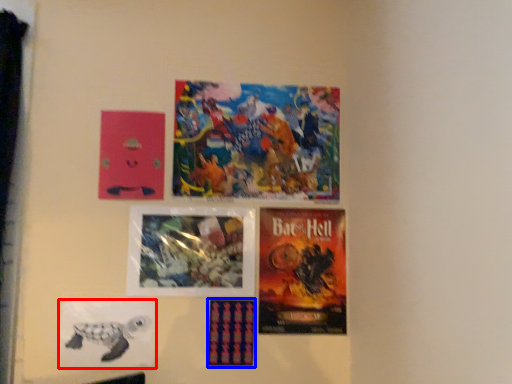
Question: Which object is further to the camera taking this photo, poster (highlighted by a red box) or poster (highlighted by a blue box)?

Choices:
 (A) poster
 (B) poster

Answer: (B)